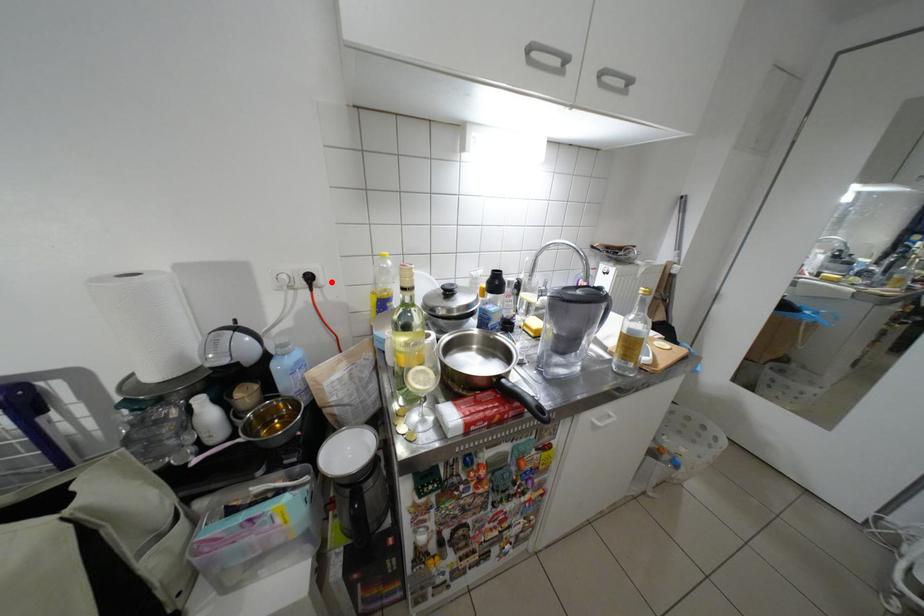
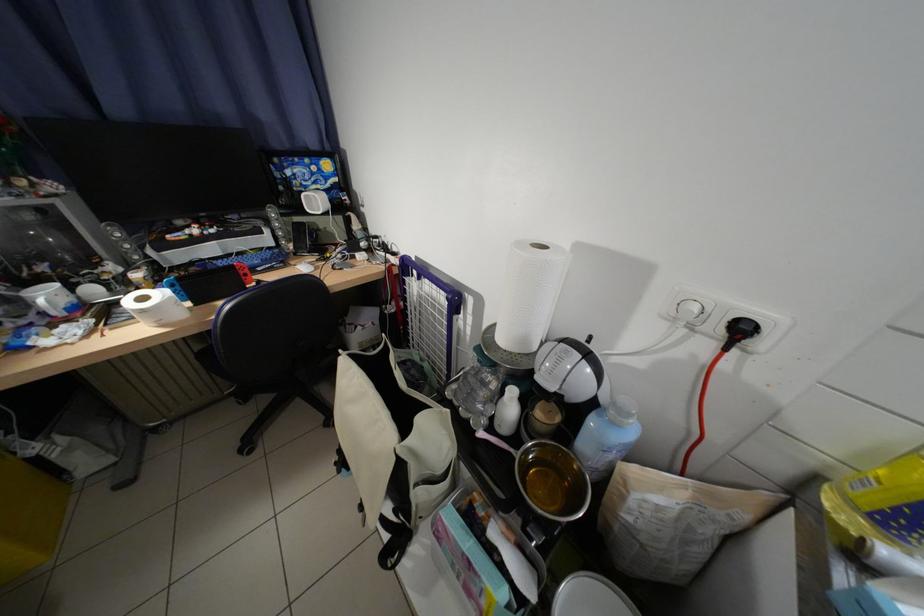
Where in the second image is the point corresponding to the highlighted location from the first image?

(772, 345)